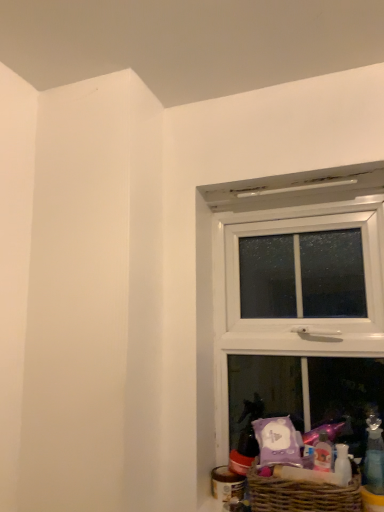
Question: In terms of width, does brown wicker basket at lower right look wider or thinner when compared to transparent plastic bottle at lower right?

Choices:
 (A) thin
 (B) wide

Answer: (B)

Question: Looking at the image, does brown wicker basket at lower right seem bigger or smaller compared to transparent plastic bottle at lower right?

Choices:
 (A) big
 (B) small

Answer: (A)

Question: Estimate the real-world distances between objects in this image. Which object is farther from the white plastic window at upper right?

Choices:
 (A) transparent plastic bottle at lower right
 (B) brown wicker basket at lower right

Answer: (A)

Question: Estimate the real-world distances between objects in this image. Which object is farther from the white plastic window at upper right?

Choices:
 (A) transparent plastic bottle at lower right
 (B) brown wicker basket at lower right

Answer: (A)